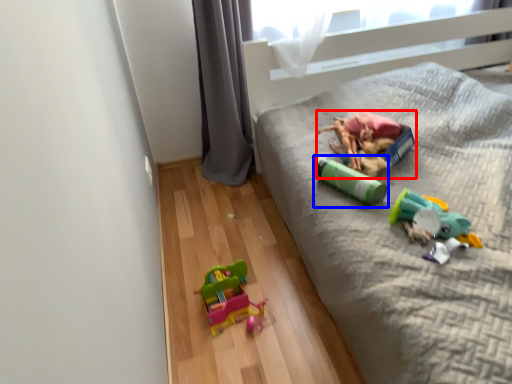
Question: Which point is further to the camera, toy (highlighted by a red box) or toy (highlighted by a blue box)?

Choices:
 (A) toy
 (B) toy

Answer: (A)